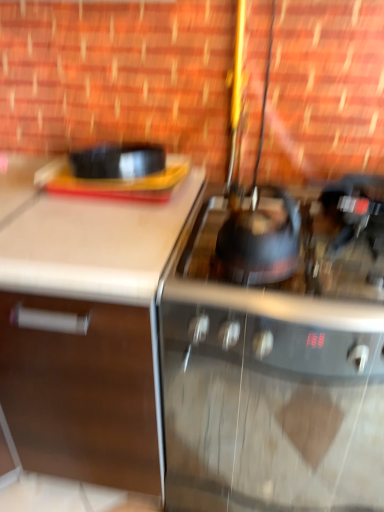
Question: Relative to stainless steel gas stove at center, the 2th gas stove when ordered from top to bottom, is shiny black kettle at center, the 1th gas stove in the top-to-bottom sequence, in front or behind?

Choices:
 (A) front
 (B) behind

Answer: (A)

Question: Is point (201, 227) positioned closer to the camera than point (357, 489)?

Choices:
 (A) farther
 (B) closer

Answer: (A)

Question: Which object is positioned farthest from the shiny black kettle at center?

Choices:
 (A) stainless steel gas stove at center, which ranks as the 1th gas stove in bottom-to-top order
 (B) shiny black kettle at center, the second gas stove when ordered from bottom to top
 (C) white matte cabinet at left

Answer: (C)

Question: Which of these objects is positioned farthest from the white matte cabinet at left?

Choices:
 (A) shiny black kettle at center
 (B) shiny black kettle at center, the second gas stove when ordered from bottom to top
 (C) stainless steel gas stove at center, which ranks as the 1th gas stove in bottom-to-top order

Answer: (A)